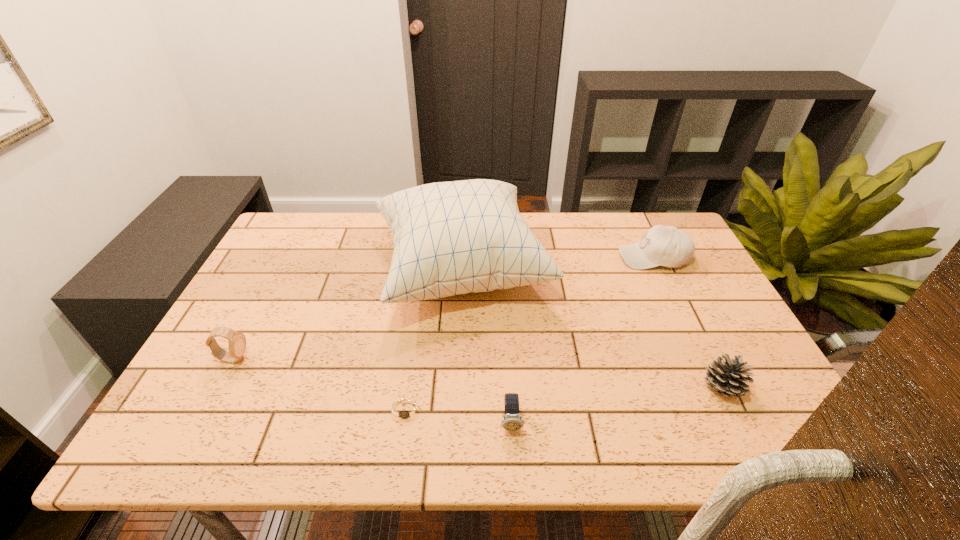
Identify the location of object located in the far right corner section of the desktop. The height and width of the screenshot is (540, 960). (668, 246).

This screenshot has width=960, height=540. Find the location of `vacant space at the far edge`. vacant space at the far edge is located at coordinates (530, 222).

Locate an element on the screen. free point at the near edge is located at coordinates 396,441.

In the image, there is a desktop. Find the location of `free region at the left edge`. free region at the left edge is located at coordinates (300, 275).

The height and width of the screenshot is (540, 960). In order to click on free region at the right edge in this screenshot , I will do `click(686, 320)`.

Where is `free region at the far left corner`? The height and width of the screenshot is (540, 960). free region at the far left corner is located at coordinates (324, 230).

The height and width of the screenshot is (540, 960). In order to click on free space at the near left corner in this screenshot , I will do `click(147, 452)`.

Locate an element on the screen. free space between the tallest watch and the pinecone is located at coordinates (477, 374).

The width and height of the screenshot is (960, 540). I want to click on free spot between the tallest object and the second watch from right to left, so click(x=434, y=340).

The width and height of the screenshot is (960, 540). I want to click on free space between the rightmost watch and the cushion, so click(x=487, y=346).